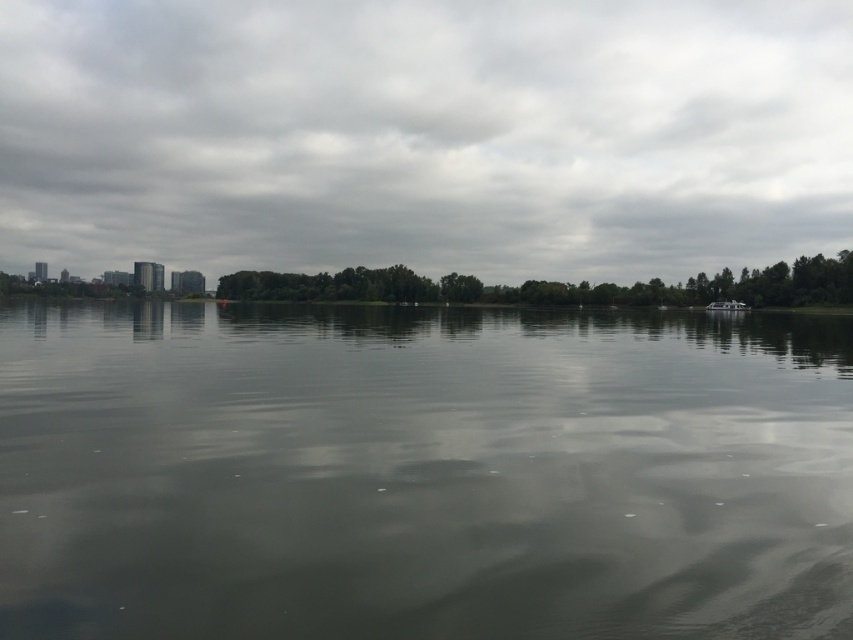
Question: Among these objects, which one is farthest from the camera?

Choices:
 (A) smooth gray water at center
 (B) white plastic boat at right
 (C) cloudy sky at upper center

Answer: (C)

Question: Is smooth gray water at center thinner than cloudy sky at upper center?

Choices:
 (A) no
 (B) yes

Answer: (B)

Question: Can you confirm if smooth gray water at center is positioned below cloudy sky at upper center?

Choices:
 (A) yes
 (B) no

Answer: (A)

Question: Which point is closer to the camera?

Choices:
 (A) green leafy trees at center
 (B) smooth gray water at center
 (C) white plastic boat at right
 (D) cloudy sky at upper center

Answer: (B)

Question: Does cloudy sky at upper center come behind green leafy trees at center?

Choices:
 (A) no
 (B) yes

Answer: (B)

Question: Which of the following is the closest to the observer?

Choices:
 (A) (577, 193)
 (B) (730, 307)
 (C) (239, 273)

Answer: (B)